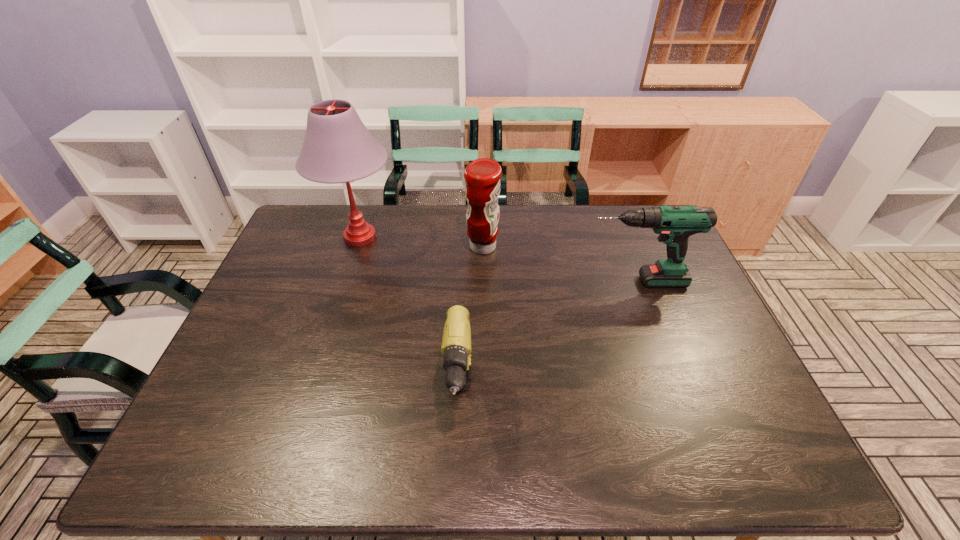
Find the location of a particular element. The width and height of the screenshot is (960, 540). vacant space at the near edge of the desktop is located at coordinates (429, 444).

Locate an element on the screen. Image resolution: width=960 pixels, height=540 pixels. blank area at the left edge is located at coordinates (239, 390).

In the image, there is a desktop. Where is `vacant space at the far left corner`? vacant space at the far left corner is located at coordinates (312, 212).

Find the location of a particular element. This screenshot has width=960, height=540. vacant space at the near right corner of the desktop is located at coordinates (778, 458).

Find the location of `empty space that is in between the nearest object and the rightmost object`. empty space that is in between the nearest object and the rightmost object is located at coordinates (547, 340).

Where is `vacant space that's between the condiment and the table lamp`? vacant space that's between the condiment and the table lamp is located at coordinates (421, 242).

Identify the location of free space between the taller drill and the nearest object. (547, 340).

The image size is (960, 540). I want to click on vacant space in between the shorter drill and the tallest object, so click(410, 318).

The width and height of the screenshot is (960, 540). I want to click on vacant space in between the right drill and the tallest object, so click(498, 259).

Where is `free area in between the taller drill and the condiment`? free area in between the taller drill and the condiment is located at coordinates (560, 264).